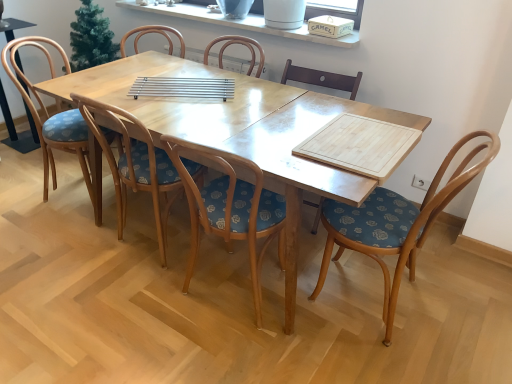
Question: Would you consider wooden chair with floral upholstery at center, positioned as the second chair in left-to-right order, to be distant from wooden at center, the second chair when ordered from right to left?

Choices:
 (A) yes
 (B) no

Answer: (A)

Question: Is wooden chair with floral upholstery at center, the fourth chair when ordered from right to left, to the left of wooden at center, the second chair when ordered from right to left, from the viewer's perspective?

Choices:
 (A) yes
 (B) no

Answer: (A)

Question: Are wooden chair with floral upholstery at center, positioned as the second chair in left-to-right order, and wooden at center, the 4th chair when ordered from left to right, making contact?

Choices:
 (A) yes
 (B) no

Answer: (B)

Question: Is wooden chair with floral upholstery at center, the fourth chair when ordered from right to left, wider than wooden at center, the 4th chair when ordered from left to right?

Choices:
 (A) no
 (B) yes

Answer: (B)

Question: Can you confirm if wooden chair with floral upholstery at center, the fourth chair when ordered from right to left, is shorter than wooden at center, the 4th chair when ordered from left to right?

Choices:
 (A) yes
 (B) no

Answer: (B)

Question: From the image's perspective, relative to wooden chair with floral cushion at center, the first chair from the left, is wooden at center, the second chair when ordered from right to left, above or below?

Choices:
 (A) above
 (B) below

Answer: (B)

Question: Is wooden at center, the 4th chair when ordered from left to right, in front of or behind wooden chair with floral cushion at center, which is the 5th chair in right-to-left order, in the image?

Choices:
 (A) behind
 (B) front

Answer: (A)

Question: Would you say wooden at center, the 4th chair when ordered from left to right, is inside or outside wooden chair with floral cushion at center, which is the 5th chair in right-to-left order?

Choices:
 (A) outside
 (B) inside

Answer: (A)

Question: Is wooden at center, the 4th chair when ordered from left to right, bigger or smaller than wooden chair with floral cushion at center, which is the 5th chair in right-to-left order?

Choices:
 (A) small
 (B) big

Answer: (A)

Question: In terms of height, does wooden at center, the 4th chair when ordered from left to right, look taller or shorter compared to wooden chair with floral upholstery at center, the 3th chair in the left-to-right sequence?

Choices:
 (A) tall
 (B) short

Answer: (B)

Question: Looking at the image, does wooden at center, the second chair when ordered from right to left, seem bigger or smaller compared to wooden chair with floral upholstery at center, marked as the third chair in a right-to-left arrangement?

Choices:
 (A) big
 (B) small

Answer: (B)

Question: From the image's perspective, is wooden at center, the 4th chair when ordered from left to right, located above or below wooden chair with floral upholstery at center, marked as the third chair in a right-to-left arrangement?

Choices:
 (A) above
 (B) below

Answer: (A)

Question: Would you say wooden at center, the 4th chair when ordered from left to right, is inside or outside wooden chair with floral upholstery at center, the 3th chair in the left-to-right sequence?

Choices:
 (A) outside
 (B) inside

Answer: (A)

Question: From a real-world perspective, is wooden chair with floral cushion at center, the first chair from the left, above or below wooden chair at left?

Choices:
 (A) above
 (B) below

Answer: (A)

Question: Considering the positions of point (75, 147) and point (25, 36), is point (75, 147) closer or farther from the camera than point (25, 36)?

Choices:
 (A) closer
 (B) farther

Answer: (A)